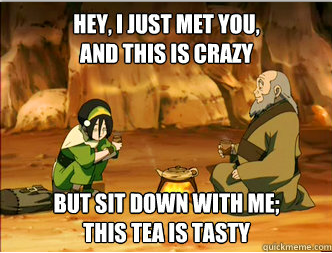
Find the location of a particular element. cup is located at coordinates (225, 148), (117, 139).